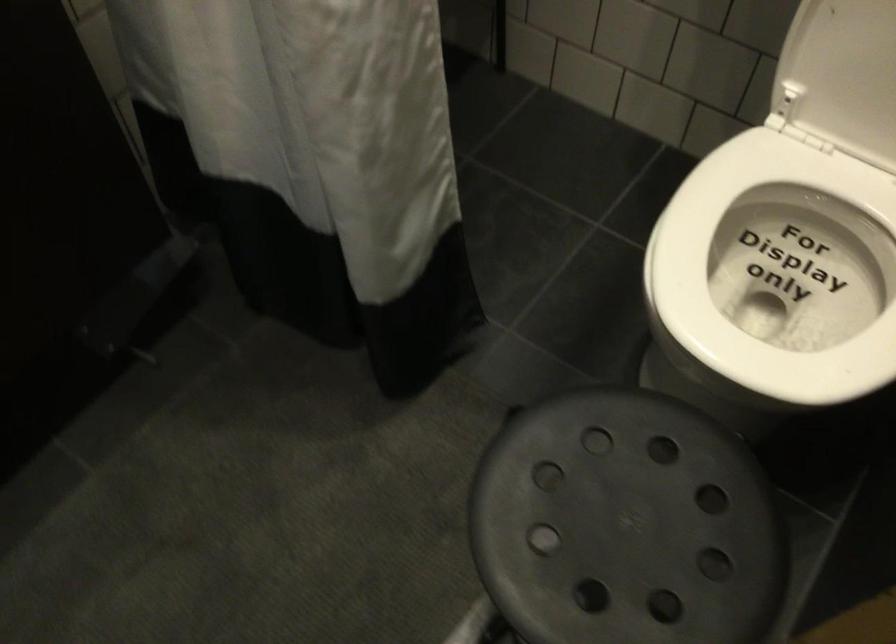
The location [625,525] corresponds to which object?

This point indicates the black round stool.